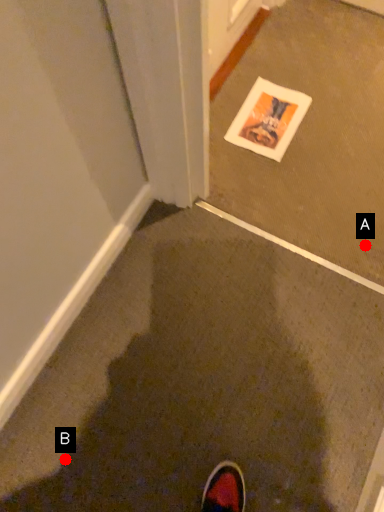
Question: Two points are circled on the image, labeled by A and B beside each circle. Which point is farther from the camera taking this photo?

Choices:
 (A) A is further
 (B) B is further

Answer: (A)